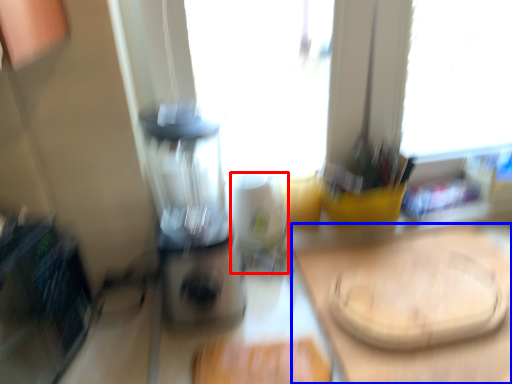
Question: Which of the following is the farthest to the observer, appliance (highlighted by a red box) or counter top (highlighted by a blue box)?

Choices:
 (A) appliance
 (B) counter top

Answer: (A)